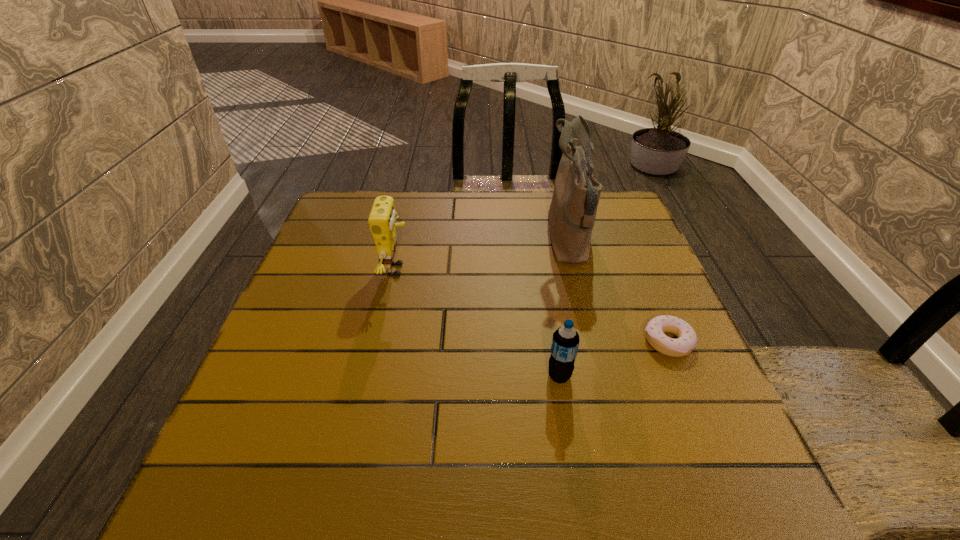
This screenshot has height=540, width=960. Identify the location of vacant position in the image that satisfies the following two spatial constraints: 1. on the face of the sponge; 2. on the back side of the nearest object. (373, 376).

Where is `free region that satisfies the following two spatial constraints: 1. on the front-facing side of the shoulder bag; 2. on the back side of the shortest object`? The width and height of the screenshot is (960, 540). free region that satisfies the following two spatial constraints: 1. on the front-facing side of the shoulder bag; 2. on the back side of the shortest object is located at coordinates (594, 342).

At what (x,y) coordinates should I click in order to perform the action: click on vacant area in the image that satisfies the following two spatial constraints: 1. on the face of the second tallest object; 2. on the right side of the soda bottle. Please return your answer as a coordinate pair (x, y). Image resolution: width=960 pixels, height=540 pixels. Looking at the image, I should click on [373, 376].

In order to click on vacant space that satisfies the following two spatial constraints: 1. on the face of the third tallest object; 2. on the left side of the leftmost object in this screenshot , I will do `click(373, 376)`.

At what (x,y) coordinates should I click in order to perform the action: click on free region that satisfies the following two spatial constraints: 1. on the front-facing side of the second nearest object; 2. on the right side of the tallest object. Please return your answer as a coordinate pair (x, y). The height and width of the screenshot is (540, 960). Looking at the image, I should click on (594, 342).

Image resolution: width=960 pixels, height=540 pixels. I want to click on blank space that satisfies the following two spatial constraints: 1. on the front-facing side of the shoulder bag; 2. on the front side of the second shortest object, so click(x=603, y=376).